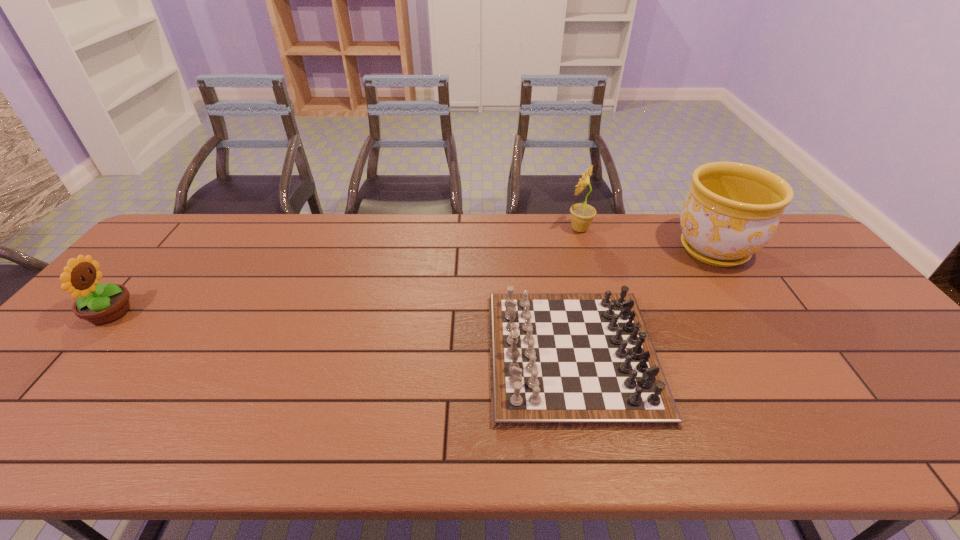
You are a GUI agent. You are given a task and a screenshot of the screen. Output one action in this format:
    pyautogui.click(x=<x>, y=<y>)
    Task: Click on the vacant space at the left edge of the desktop
    
    Given the screenshot: What is the action you would take?
    pyautogui.click(x=126, y=315)

Identify the location of vacant region at the far left corner of the desktop. (159, 245).

Image resolution: width=960 pixels, height=540 pixels. I want to click on blank region between the right sunflower and the flowerpot, so click(647, 239).

This screenshot has height=540, width=960. I want to click on empty location between the farther sunflower and the leftmost object, so click(x=345, y=271).

At what (x,y) coordinates should I click in order to perform the action: click on free spot between the leftmost object and the taller sunflower. Please return your answer as a coordinate pair (x, y). The width and height of the screenshot is (960, 540). Looking at the image, I should click on (345, 271).

I want to click on unoccupied position between the third tallest object and the farther sunflower, so click(345, 271).

I want to click on blank region between the leftmost object and the right sunflower, so click(345, 271).

Locate an element on the screen. vacant space that's between the shortest object and the flowerpot is located at coordinates (643, 302).

The height and width of the screenshot is (540, 960). What are the coordinates of `vacant area that lies between the flowerpot and the nearer sunflower` in the screenshot? It's located at (412, 281).

Identify the location of empty space that is in between the right sunflower and the rightmost object. (647, 239).